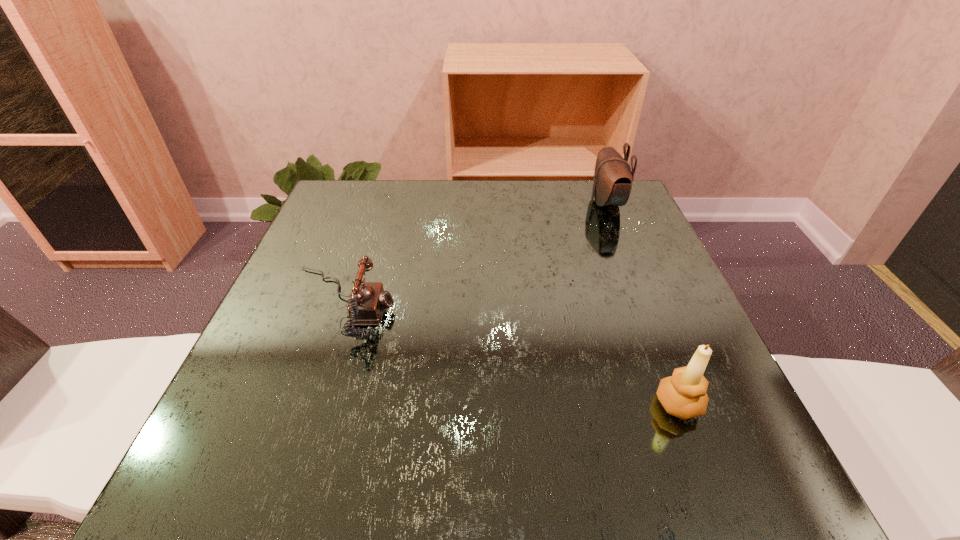
Locate an element on the screen. The image size is (960, 540). object present at the left edge is located at coordinates (367, 302).

Image resolution: width=960 pixels, height=540 pixels. In order to click on pouch present at the right edge in this screenshot , I will do `click(613, 178)`.

Image resolution: width=960 pixels, height=540 pixels. I want to click on candle_holder located at the right edge, so click(683, 395).

This screenshot has height=540, width=960. I want to click on object that is at the far right corner, so click(x=613, y=178).

You are a GUI agent. You are given a task and a screenshot of the screen. Output one action in this format:
    pyautogui.click(x=<x>, y=<y>)
    Task: Click on the vacant region at the far edge
    This screenshot has width=960, height=540.
    Given the screenshot: What is the action you would take?
    pyautogui.click(x=518, y=195)

Image resolution: width=960 pixels, height=540 pixels. In order to click on free space at the near edge of the desktop in this screenshot , I will do `click(380, 456)`.

Find the location of `free point at the left edge`. free point at the left edge is located at coordinates (250, 356).

The width and height of the screenshot is (960, 540). Find the location of `free spot at the right edge of the desktop`. free spot at the right edge of the desktop is located at coordinates (645, 240).

Locate an element on the screen. This screenshot has width=960, height=540. vacant space at the far left corner of the desktop is located at coordinates (348, 179).

The width and height of the screenshot is (960, 540). In the image, there is a desktop. Identify the location of free region at the far right corner. (585, 195).